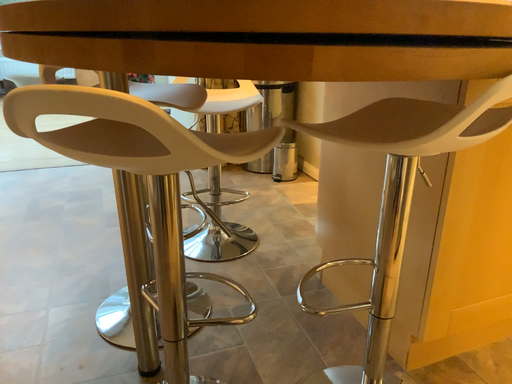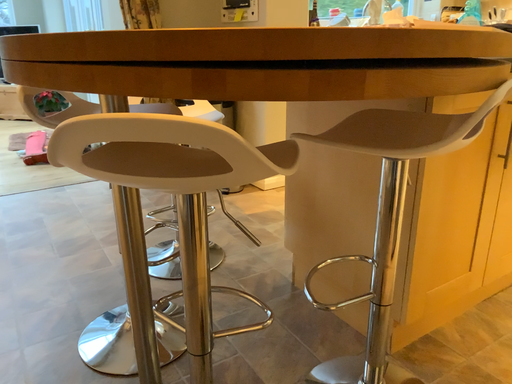
Question: How did the camera likely rotate when shooting the video?

Choices:
 (A) rotated left
 (B) rotated right

Answer: (B)